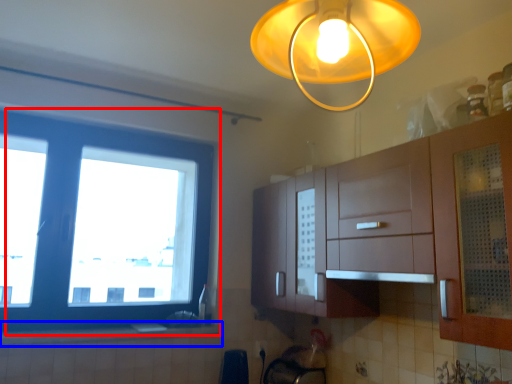
Question: Which of the following is the closest to the observer, window (highlighted by a red box) or counter top (highlighted by a blue box)?

Choices:
 (A) window
 (B) counter top

Answer: (B)